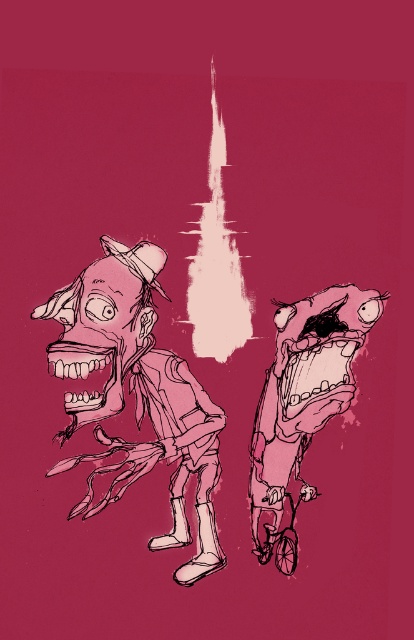
Question: Where is pink matte zombie at left located in relation to pink matte/soft sculpture at center in the image?

Choices:
 (A) below
 (B) above

Answer: (B)

Question: Can you confirm if pink matte zombie at left is positioned to the right of pink matte/soft sculpture at center?

Choices:
 (A) no
 (B) yes

Answer: (A)

Question: Which point is farther from the camera taking this photo?

Choices:
 (A) (40, 314)
 (B) (298, 467)

Answer: (B)

Question: Among these points, which one is farthest from the camera?

Choices:
 (A) (315, 401)
 (B) (60, 465)

Answer: (A)

Question: Is pink matte zombie at left behind pink matte/soft sculpture at center?

Choices:
 (A) no
 (B) yes

Answer: (A)